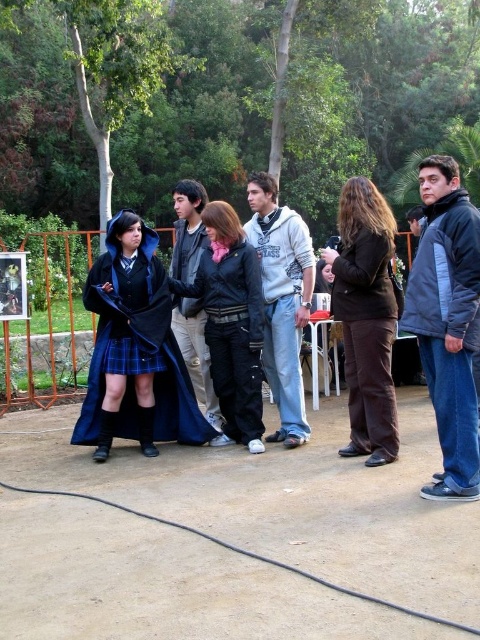
Question: Can you confirm if leather jacket at center is bigger than light gray hoodie at center?

Choices:
 (A) no
 (B) yes

Answer: (B)

Question: Is brown leather jacket at center bigger than light gray hoodie at center?

Choices:
 (A) yes
 (B) no

Answer: (B)

Question: Which of the following is the closest to the observer?

Choices:
 (A) dark blue jacket at right
 (B) brown leather jacket at center
 (C) matte blue coat at center

Answer: (A)

Question: Which object is closer to the camera taking this photo?

Choices:
 (A) leather jacket at center
 (B) matte blue coat at center

Answer: (B)

Question: Does leather jacket at center appear on the right side of blue plaid kilt at center?

Choices:
 (A) no
 (B) yes

Answer: (B)

Question: Which of the following is the closest to the observer?

Choices:
 (A) brown leather jacket at center
 (B) light gray hoodie at center
 (C) dark blue leather jacket at center

Answer: (A)